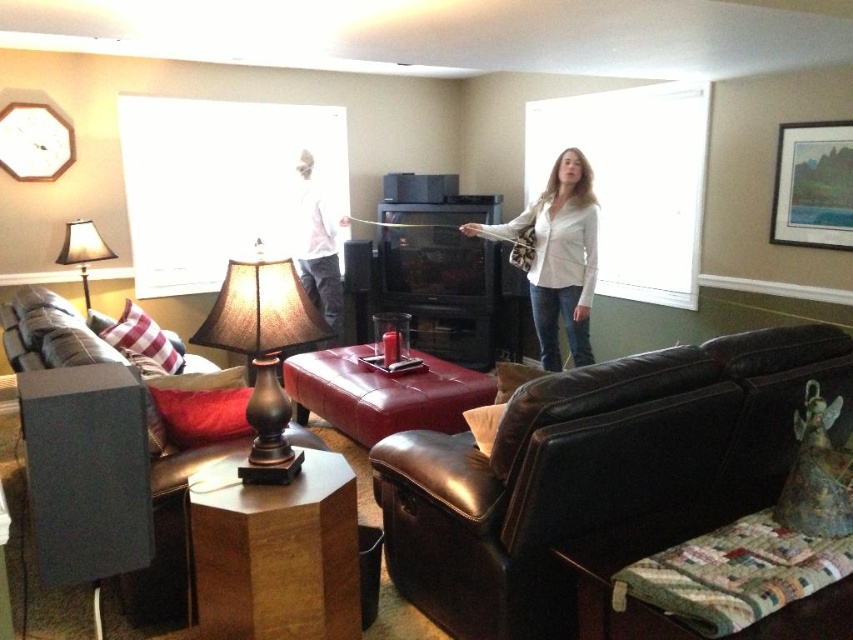
You are standing at the center of the living room and want to sit on the leather couch at lower left. Which direction should you move to reach it?

Since the leather couch at lower left is located at point (x=163, y=544), you should move towards the lower left direction to reach it.

You are planning to place a new decorative item on the smaller object between the matte brown lamp at center and the leather ottoman at center. Which object should you choose to place it on?

The matte brown lamp at center is smaller than the leather ottoman at center, so you should place the decorative item on the matte brown lamp at center.